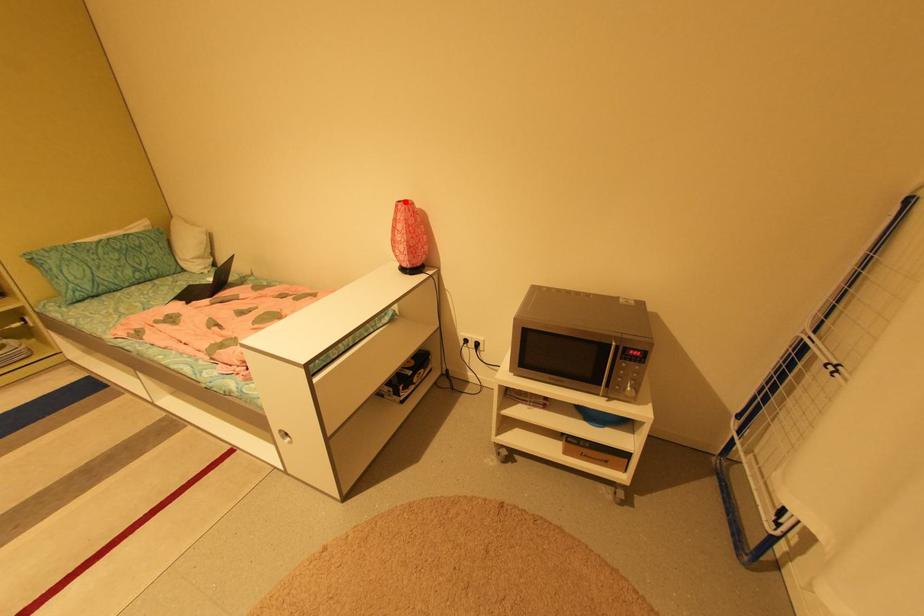
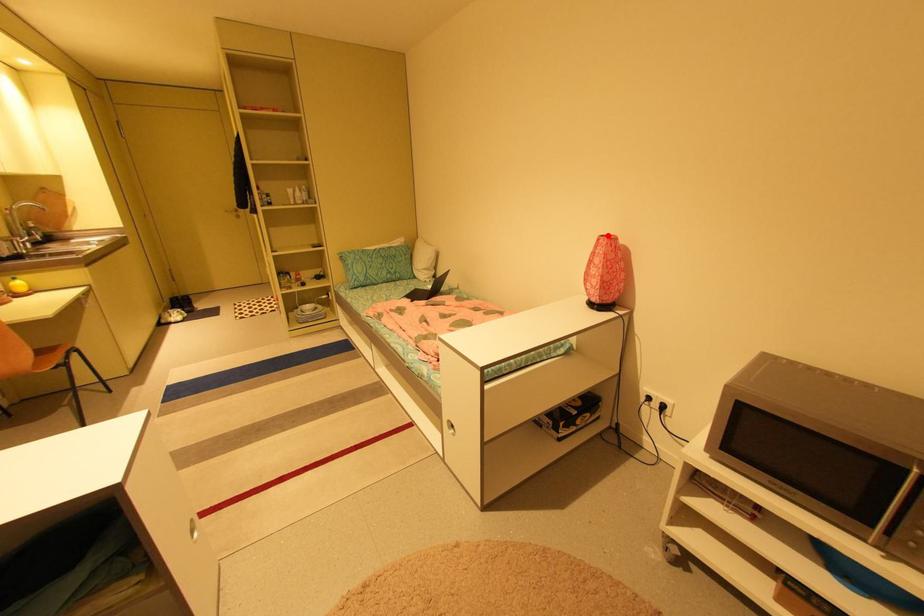
I am providing you with two images of the same scene from different viewpoints. A red point is marked on the first image and another point is marked on the second image. Is the red point in image1 aligned with the point shown in image2?

Yes